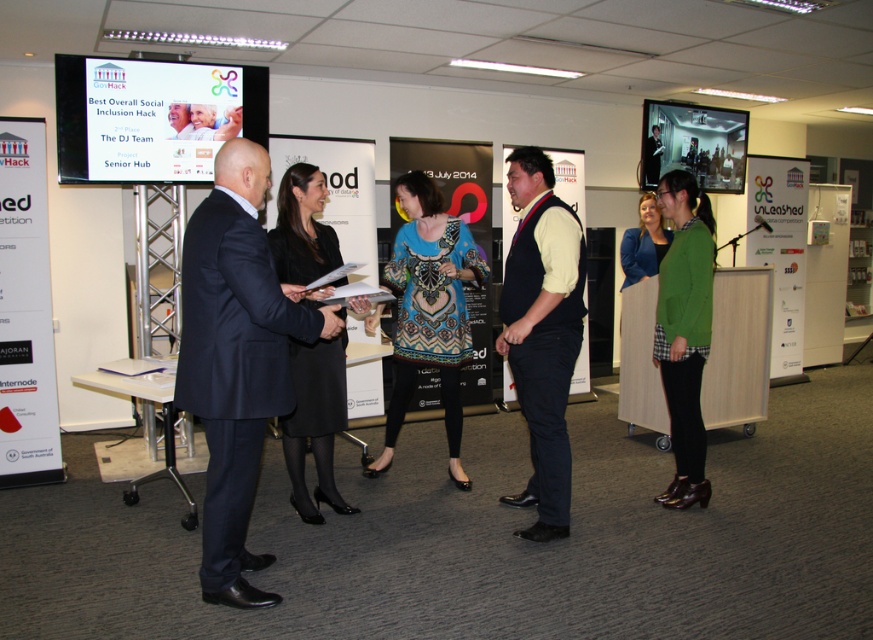
Question: Does patterned fabric dress at center appear over white paperboard at right?

Choices:
 (A) no
 (B) yes

Answer: (A)

Question: Which of the following is the closest to the observer?

Choices:
 (A) white paper at left
 (B) dark blue suit at center

Answer: (B)

Question: Which object is the farthest from the blue velvet jacket at center?

Choices:
 (A) black fabric dress at center
 (B) black matte vest at center
 (C) matte plastic poster at upper center
 (D) white paper at left

Answer: (D)

Question: Which point appears closest to the camera in this image?

Choices:
 (A) (535, 161)
 (B) (183, 74)
 (C) (369, 474)
 (D) (681, 134)

Answer: (A)

Question: Can you confirm if matte plastic poster at upper center is bigger than matte black monitor at upper center?

Choices:
 (A) yes
 (B) no

Answer: (B)

Question: In this image, where is white paperboard at right located relative to blue velvet jacket at center?

Choices:
 (A) below
 (B) above

Answer: (A)